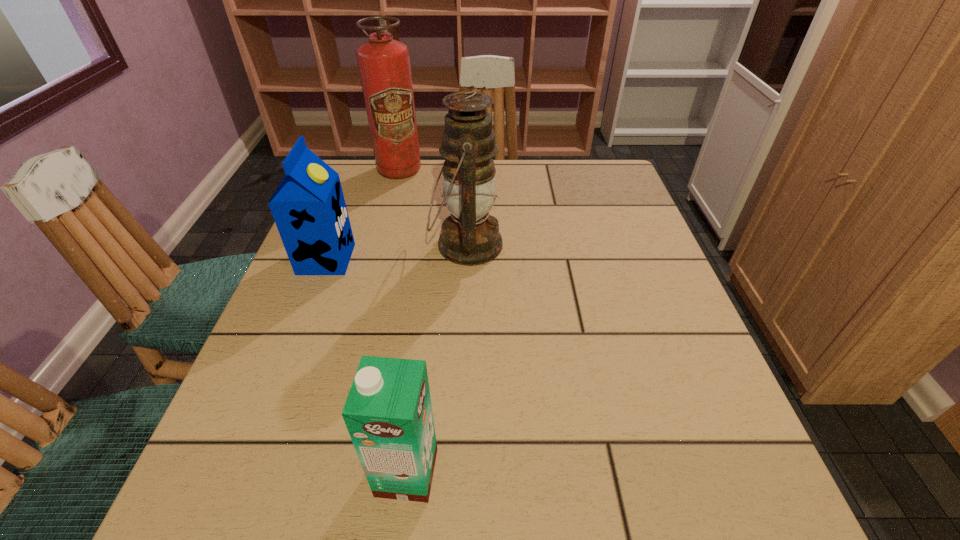
I want to click on object that is the third closest to the lantern, so click(388, 413).

Point out which object is positioned as the nearest to the lantern. Please provide its 2D coordinates. Your answer should be formatted as a tuple, i.e. [(x, y)], where the tuple contains the x and y coordinates of a point satisfying the conditions above.

[(308, 207)]

Where is `vacant space that satisfies the following two spatial constraints: 1. on the label side of the farthest object; 2. on the left side of the lantern`? vacant space that satisfies the following two spatial constraints: 1. on the label side of the farthest object; 2. on the left side of the lantern is located at coordinates (379, 245).

Where is `blank space that satisfies the following two spatial constraints: 1. on the label side of the nearest object; 2. on the right side of the fire extinguisher`? This screenshot has width=960, height=540. blank space that satisfies the following two spatial constraints: 1. on the label side of the nearest object; 2. on the right side of the fire extinguisher is located at coordinates (320, 472).

Identify the location of vacant space that satisfies the following two spatial constraints: 1. on the back side of the nearer carton; 2. with the cap open on the farther carton. (433, 259).

You are a GUI agent. You are given a task and a screenshot of the screen. Output one action in this format:
    pyautogui.click(x=<x>, y=<y>)
    Task: Click on the free point that satisfies the following two spatial constraints: 1. on the back side of the nearer carton; 2. on the right side of the lantern
    
    Given the screenshot: What is the action you would take?
    pyautogui.click(x=434, y=245)

You are a GUI agent. You are given a task and a screenshot of the screen. Output one action in this format:
    pyautogui.click(x=<x>, y=<y>)
    Task: Click on the vacant area in the image that satisfies the following two spatial constraints: 1. on the label side of the lantern; 2. on the left side of the farthest object
    The width and height of the screenshot is (960, 540).
    Given the screenshot: What is the action you would take?
    pyautogui.click(x=379, y=245)

The height and width of the screenshot is (540, 960). What are the coordinates of `vacant region that satisfies the following two spatial constraints: 1. on the label side of the lantern; 2. on the left side of the fire extinguisher` in the screenshot? It's located at (379, 245).

Where is `blank area in the image that satisfies the following two spatial constraints: 1. on the label side of the lantern; 2. on the right side of the farthest object`? blank area in the image that satisfies the following two spatial constraints: 1. on the label side of the lantern; 2. on the right side of the farthest object is located at coordinates (x=379, y=245).

Where is `vacant space that satisfies the following two spatial constraints: 1. with the cap open on the left carton; 2. on the right side of the right carton`? vacant space that satisfies the following two spatial constraints: 1. with the cap open on the left carton; 2. on the right side of the right carton is located at coordinates (243, 472).